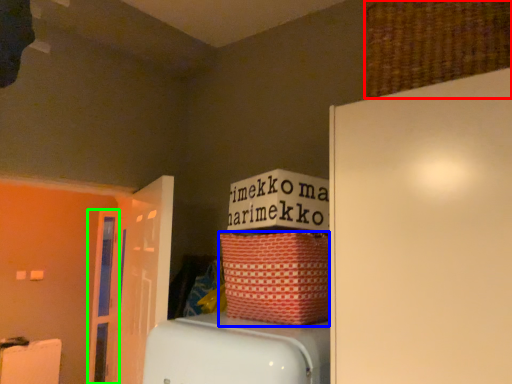
Question: Based on their relative distances, which object is nearer to basket (highlighted by a red box)? Choose from basket (highlighted by a blue box) and door (highlighted by a green box).

Choices:
 (A) basket
 (B) door

Answer: (A)